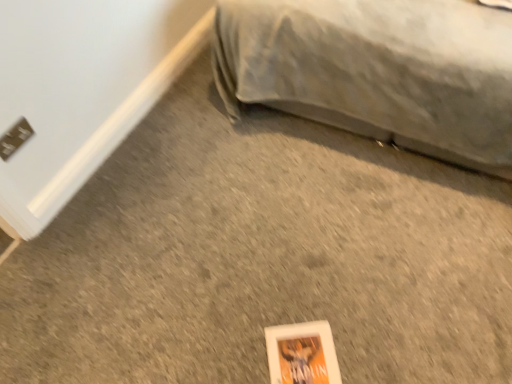
Question: Is white matte paperback book at lower center inside the boundaries of metallic gray electric outlet at lower left, or outside?

Choices:
 (A) inside
 (B) outside

Answer: (B)

Question: Is white matte paperback book at lower center taller or shorter than metallic gray electric outlet at lower left?

Choices:
 (A) short
 (B) tall

Answer: (A)

Question: Which object is the farthest from the gray fabric bed at upper right?

Choices:
 (A) white matte paperback book at lower center
 (B) metallic gray electric outlet at lower left

Answer: (B)

Question: Which object is the closest to the white matte paperback book at lower center?

Choices:
 (A) metallic gray electric outlet at lower left
 (B) gray fabric bed at upper right

Answer: (B)